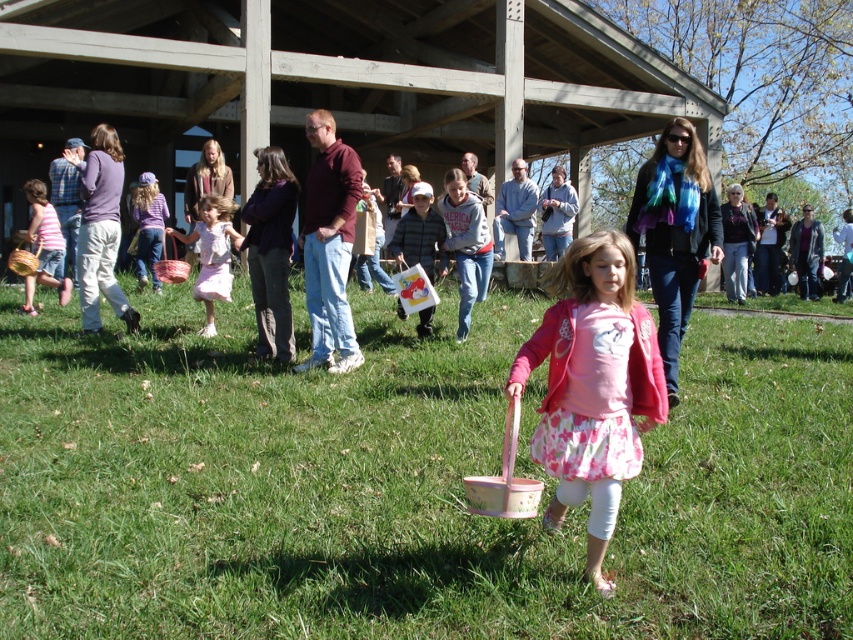
Between green grass at center and matte pink dress at left, which one is positioned higher?

matte pink dress at left

Is point (764, 605) in front of point (44, 282)?

Yes, it is in front of point (44, 282).

The height and width of the screenshot is (640, 853). I want to click on green grass at center, so click(403, 484).

Locate an element on the screen. green grass at center is located at coordinates (403, 484).

The width and height of the screenshot is (853, 640). What do you see at coordinates (593, 387) in the screenshot? I see `pink floral skirt at center` at bounding box center [593, 387].

Does pink floral skirt at center appear on the left side of pink fabric dress at center?

No, pink floral skirt at center is not to the left of pink fabric dress at center.

Between point (563, 374) and point (234, 202), which one is positioned in front?

Point (563, 374) is more forward.

The width and height of the screenshot is (853, 640). I want to click on pink floral skirt at center, so click(593, 387).

Describe the element at coordinates (212, 253) in the screenshot. This screenshot has width=853, height=640. I see `pink fabric dress at center` at that location.

Is pink fabric dress at center to the left of matte pink dress at left from the viewer's perspective?

Incorrect, pink fabric dress at center is not on the left side of matte pink dress at left.

You are a GUI agent. You are given a task and a screenshot of the screen. Output one action in this format:
    pyautogui.click(x=<x>, y=<y>)
    Task: Click on the pink fabric dress at center
    The height and width of the screenshot is (640, 853).
    Given the screenshot: What is the action you would take?
    pyautogui.click(x=212, y=253)

This screenshot has width=853, height=640. What are the coordinates of `pink fabric dress at center` in the screenshot? It's located at (212, 253).